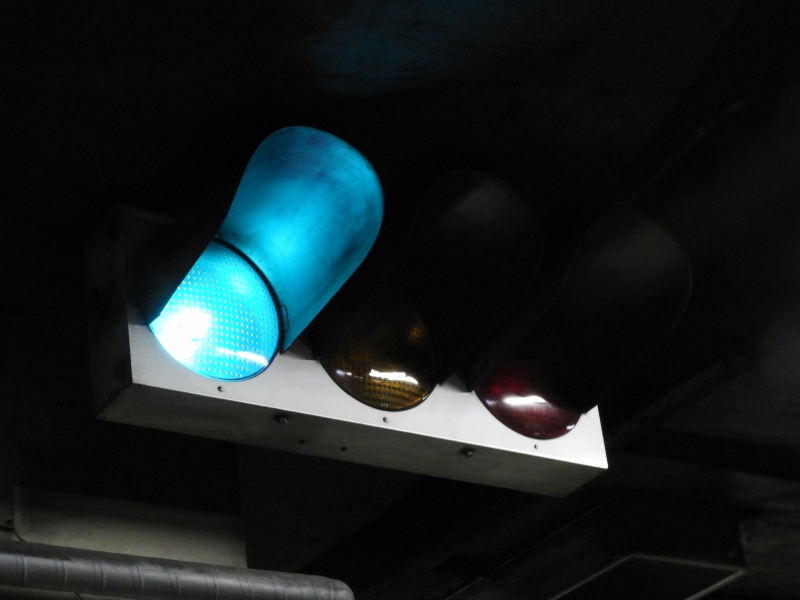
Identify the location of vent. (636, 582).